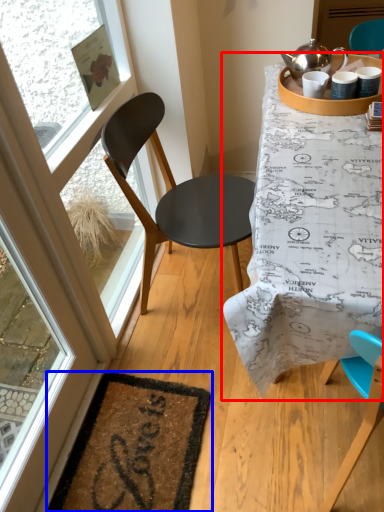
Question: Which object is further to the camera taking this photo, table (highlighted by a red box) or mat (highlighted by a blue box)?

Choices:
 (A) table
 (B) mat

Answer: (B)